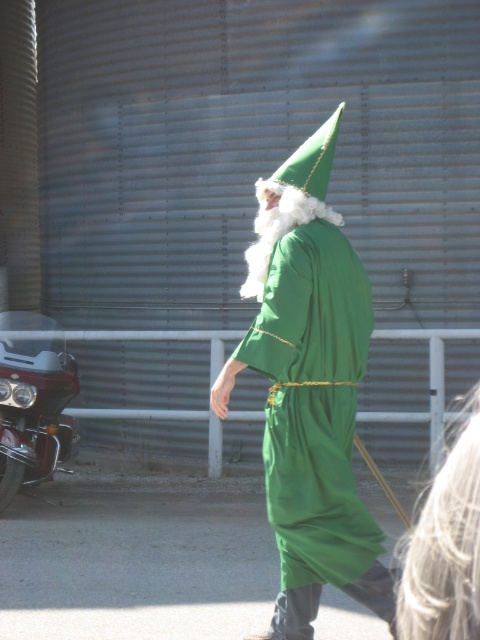
Question: Observing the image, what is the correct spatial positioning of green matte/golden trim wizard hat at center in reference to shiny chrome motorcycle at left?

Choices:
 (A) above
 (B) below

Answer: (A)

Question: In this image, where is green matte/golden trim wizard hat at center located relative to shiny chrome motorcycle at left?

Choices:
 (A) right
 (B) left

Answer: (A)

Question: Among these objects, which one is farthest from the camera?

Choices:
 (A) shiny chrome motorcycle at left
 (B) green matte/golden trim wizard hat at center

Answer: (A)

Question: Does green matte/golden trim wizard hat at center have a larger size compared to shiny chrome motorcycle at left?

Choices:
 (A) yes
 (B) no

Answer: (A)